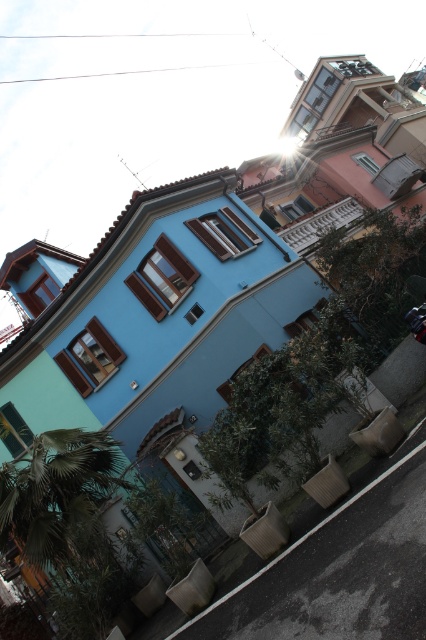
Question: Does green leafy palm tree at lower left appear on the left side of shiny chrome motorcycle at center?

Choices:
 (A) yes
 (B) no

Answer: (A)

Question: Among these points, which one is farthest from the camera?

Choices:
 (A) (417, 323)
 (B) (5, 486)

Answer: (B)

Question: Does green leafy palm tree at lower left have a larger size compared to shiny chrome motorcycle at center?

Choices:
 (A) yes
 (B) no

Answer: (A)

Question: Which object appears closest to the camera in this image?

Choices:
 (A) shiny chrome motorcycle at center
 (B) green leafy palm tree at lower left

Answer: (A)

Question: Which object is farther from the camera taking this photo?

Choices:
 (A) green leafy palm tree at lower left
 (B) shiny chrome motorcycle at center

Answer: (A)

Question: Can you confirm if green leafy palm tree at lower left is wider than shiny chrome motorcycle at center?

Choices:
 (A) yes
 (B) no

Answer: (A)